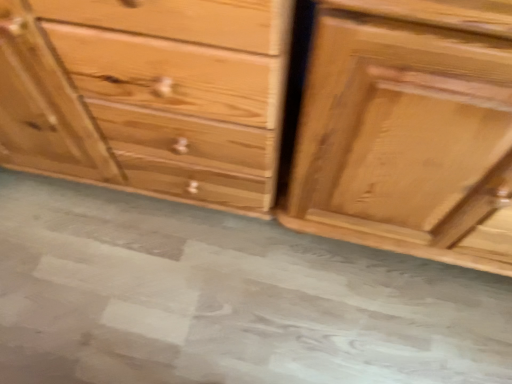
Question: Would you say gray concrete at center is to the left or to the right of natural wood chest of drawers at center, which is the first chest of drawers in left-to-right order, in the picture?

Choices:
 (A) left
 (B) right

Answer: (B)

Question: Considering the positions of point (312, 289) and point (75, 142), is point (312, 289) closer or farther from the camera than point (75, 142)?

Choices:
 (A) closer
 (B) farther

Answer: (B)

Question: Which is nearer to the natural wood chest of drawers at center, which is the first chest of drawers in left-to-right order?

Choices:
 (A) shiny brown wood drawer at right, the 1th chest of drawers viewed from the right
 (B) gray concrete at center

Answer: (A)

Question: Which object is positioned closest to the shiny brown wood drawer at right, which is the 2th chest of drawers from left to right?

Choices:
 (A) natural wood chest of drawers at center, which is the first chest of drawers in left-to-right order
 (B) gray concrete at center

Answer: (A)